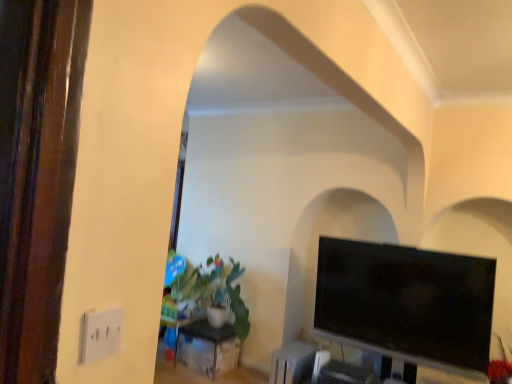
The image size is (512, 384). In order to click on black metal table at center in this screenshot , I will do `click(206, 336)`.

Is green matte plant at center-left facing towards black metal table at center?

No, green matte plant at center-left is not oriented towards black metal table at center.

Is green matte plant at center-left positioned in front of black metal table at center?

Yes.

Looking at this image, does green matte plant at center-left appear on the left side of black metal table at center?

No.

Does black metal table at center have a lesser width compared to green matte plant at center-left?

Indeed, black metal table at center has a lesser width compared to green matte plant at center-left.

Consider the image. Would you say black metal table at center is inside or outside green matte plant at center-left?

black metal table at center exists outside the volume of green matte plant at center-left.

Could you tell me if black metal table at center is turned towards green matte plant at center-left?

No, black metal table at center is not turned towards green matte plant at center-left.

Is black glossy tv at right aimed at black metal table at center?

No, black glossy tv at right is not aimed at black metal table at center.

Which point is more distant from viewer, (x=329, y=321) or (x=220, y=332)?

The point (x=220, y=332) is farther from the camera.

From a real-world perspective, does black glossy tv at right stand above black metal table at center?

Yes.

At what (x,y) coordinates should I click in order to perform the action: click on television in front of the black metal table at center. Please return your answer as a coordinate pair (x, y). Looking at the image, I should click on (407, 303).

From the image's perspective, between black metal table at center and black glossy tv at right, which one is located above?

From the image's view, black glossy tv at right is above.

From their relative heights in the image, would you say black metal table at center is taller or shorter than black glossy tv at right?

In the image, black metal table at center appears to be shorter than black glossy tv at right.

The height and width of the screenshot is (384, 512). I want to click on television in front of the black metal table at center, so click(x=407, y=303).

Which object is wider, black glossy tv at right or green matte plant at center-left?

green matte plant at center-left is wider.

Between black glossy tv at right and green matte plant at center-left, which one appears on the right side from the viewer's perspective?

black glossy tv at right is more to the right.

Is point (440, 292) positioned behind point (191, 296)?

That is False.

Would you say green matte plant at center-left is part of black glossy tv at right's contents?

No.

Looking at this image, from a real-world perspective, does green matte plant at center-left sit lower than black glossy tv at right?

Indeed, from a real-world perspective, green matte plant at center-left is positioned beneath black glossy tv at right.

This screenshot has width=512, height=384. I want to click on television in front of the green matte plant at center-left, so click(407, 303).

Is green matte plant at center-left positioned far away from black glossy tv at right?

Indeed, green matte plant at center-left is not near black glossy tv at right.

Does green matte plant at center-left appear on the left side of black glossy tv at right?

Indeed, green matte plant at center-left is positioned on the left side of black glossy tv at right.

This screenshot has width=512, height=384. Identify the location of table that appears below the green matte plant at center-left (from the image's perspective). click(206, 336).

At what (x,y) coordinates should I click in order to perform the action: click on houseplant located on the right of black metal table at center. Please return your answer as a coordinate pair (x, y). The image size is (512, 384). Looking at the image, I should click on (215, 290).

In the scene shown: Looking at the image, which one is located closer to green matte plant at center-left, black metal table at center or black glossy tv at right?

Among the two, black metal table at center is located nearer to green matte plant at center-left.

Which object lies further to the anchor point black metal table at center, black glossy tv at right or green matte plant at center-left?

Among the two, black glossy tv at right is located further to black metal table at center.

Considering their positions, is green matte plant at center-left positioned closer to black glossy tv at right than black metal table at center?

The object closer to black glossy tv at right is green matte plant at center-left.

Estimate the real-world distances between objects in this image. Which object is further from black glossy tv at right, black metal table at center or green matte plant at center-left?

The object further to black glossy tv at right is black metal table at center.

Looking at the image, which one is located closer to black metal table at center, green matte plant at center-left or black glossy tv at right?

green matte plant at center-left.

Estimate the real-world distances between objects in this image. Which object is closer to green matte plant at center-left, black glossy tv at right or black metal table at center?

Among the two, black metal table at center is located nearer to green matte plant at center-left.

Image resolution: width=512 pixels, height=384 pixels. I want to click on houseplant situated between black metal table at center and black glossy tv at right from left to right, so click(215, 290).